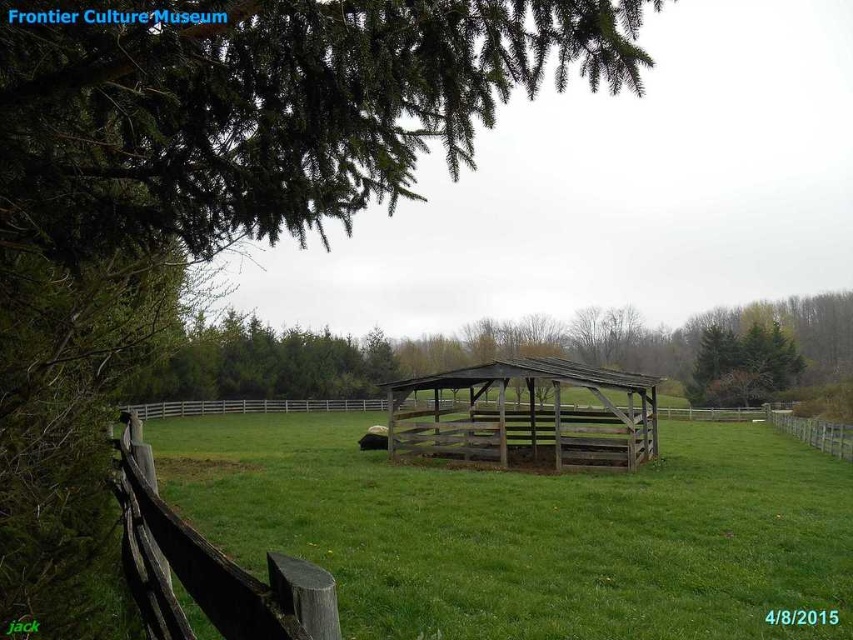
You are a visitor at the Frontier Culture Museum and want to take a photo of the green grassy field at center and green wood tree at center. Which object should you focus on first if you want to capture both in a single shot without moving the camera?

You should focus on the green grassy field at center first because it is closer to the camera than the green wood tree at center, allowing both to be in the frame without moving the camera.

You are standing in the rural scene at the Frontier Culture Museum and want to determine which tree has a larger width. You see the green wood tree at center and the green leafy tree at upper right. Based on the information provided, which tree is wider?

The green wood tree at center might be wider than green leafy tree at upper right.

You are a gardener planning to plant a row of flowers between the green grassy field at center and the green wood tree at center. Based on their widths, which area should you choose to ensure the flowers have enough space to grow?

The green wood tree at center has a greater width than the green grassy field at center, so you should plant the flowers near the green wood tree at center to ensure they have enough space to grow.